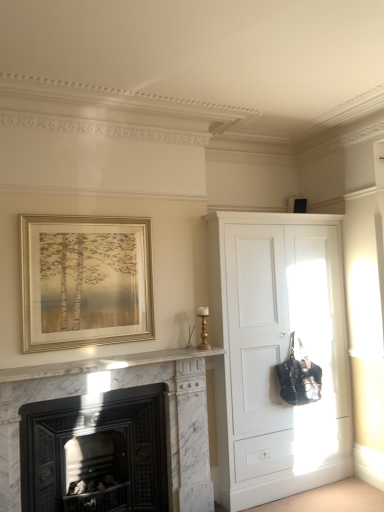
Question: Is gold metallic frame at upper left positioned with its back to white matte cupboard at right?

Choices:
 (A) yes
 (B) no

Answer: (B)

Question: From the image's perspective, would you say gold metallic frame at upper left is shown under white matte cupboard at right?

Choices:
 (A) yes
 (B) no

Answer: (B)

Question: Does gold metallic frame at upper left have a lesser height compared to white matte cupboard at right?

Choices:
 (A) no
 (B) yes

Answer: (B)

Question: From a real-world perspective, is gold metallic frame at upper left under white matte cupboard at right?

Choices:
 (A) yes
 (B) no

Answer: (B)

Question: Is gold metallic frame at upper left thinner than white matte cupboard at right?

Choices:
 (A) yes
 (B) no

Answer: (A)

Question: Is the position of gold metallic frame at upper left less distant than that of white matte cupboard at right?

Choices:
 (A) no
 (B) yes

Answer: (B)

Question: Is white matte cupboard at right thinner than marble fireplace at lower left?

Choices:
 (A) yes
 (B) no

Answer: (B)

Question: Is white matte cupboard at right shorter than marble fireplace at lower left?

Choices:
 (A) no
 (B) yes

Answer: (A)

Question: Is white matte cupboard at right aimed at marble fireplace at lower left?

Choices:
 (A) no
 (B) yes

Answer: (A)

Question: Is white matte cupboard at right positioned beyond the bounds of marble fireplace at lower left?

Choices:
 (A) yes
 (B) no

Answer: (A)

Question: Is white matte cupboard at right wider than marble fireplace at lower left?

Choices:
 (A) no
 (B) yes

Answer: (B)

Question: Is white matte cupboard at right positioned with its back to marble fireplace at lower left?

Choices:
 (A) no
 (B) yes

Answer: (A)

Question: Is white matte cupboard at right shorter than gold metallic frame at upper left?

Choices:
 (A) no
 (B) yes

Answer: (A)